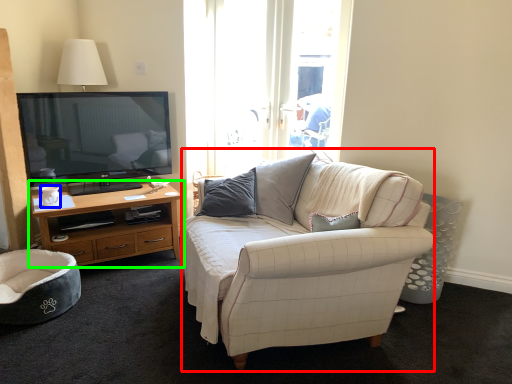
Question: Considering the real-world distances, which object is closest to studio couch (highlighted by a red box)? coffee cup (highlighted by a blue box) or cabinetry (highlighted by a green box).

Choices:
 (A) coffee cup
 (B) cabinetry

Answer: (B)